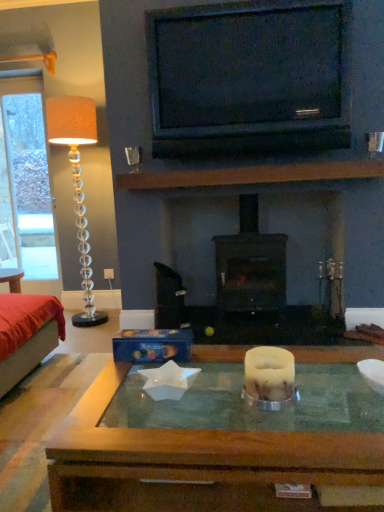
Question: Is black matte wood burning stove at center inside the boundaries of translucent glass floor lamp at left, or outside?

Choices:
 (A) outside
 (B) inside

Answer: (A)

Question: From a real-world perspective, is black matte wood burning stove at center positioned above or below translucent glass floor lamp at left?

Choices:
 (A) above
 (B) below

Answer: (B)

Question: Which object is the closest to the white wax candle at center?

Choices:
 (A) black matte wood burning stove at center
 (B) white plastic power outlet at lower center
 (C) velvet red bed at left
 (D) translucent glass floor lamp at left
 (E) metallic silver coffee cup at upper left

Answer: (C)

Question: Which is nearer to the translucent glass floor lamp at left?

Choices:
 (A) velvet red bed at left
 (B) black glossy tv at upper center
 (C) white wax candle at center
 (D) white plastic power outlet at lower center
 (E) metallic silver coffee cup at upper left

Answer: (D)